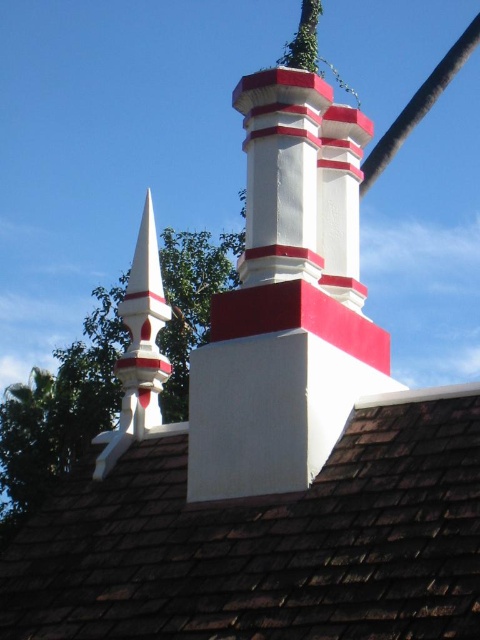
You are a contractor assessing the roof for maintenance. You notice the brown shingles at upper center and the black rubber pole at upper center. Which object would require more material if you were to cover them both with a protective coating? Explain your reasoning based on their sizes.

The black rubber pole at upper center requires more material for the protective coating because it is larger than the brown shingles at upper center, as stated in the description.

You are standing on the ground looking at the roof. Which object is closer to you between the brown shingles at upper center and the black rubber pole at upper center?

The brown shingles at upper center is in front of the black rubber pole at upper center, so it is closer to you.

You are a contractor assessing the roof. You see the brown shingles at upper center and the black rubber pole at upper center. Which object is positioned to the left?

The brown shingles at upper center is to the left of the black rubber pole at upper center.